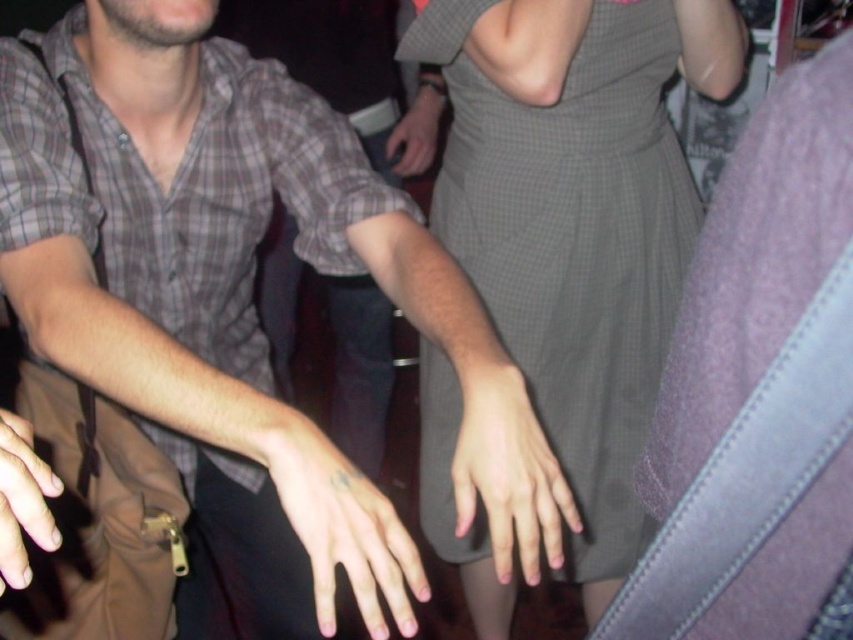
In the scene, there are two people. The first person is wearing a plaid short sleeve shirt and khaki pants, and the second person is in a gray knee length dress. There is also a hand at point (22, 500). Which person is the hand attached to?

The smooth skin hand at lower left located at point (22, 500) is attached to the first person wearing a plaid short sleeve shirt and khaki pants because the description specifies it is at lower left, which would be near the first person.

You are a photographer adjusting a camera with a 10cm wide lens. The camera is positioned to capture the pale skin tattooed hand at center. If the camera is at point 0.5,0.5, will the lens cover the hand at 0.820,0.401?

The pale skin tattooed hand at center is located at coordinates (341, 524). Since the camera lens is centered at (426, 320) and has a width of 10cm, the distance between the two points must be calculated. The Euclidean distance between these points is sqrt. However, without knowing the image dimensions, it is impossible to determine if the 10cm width covers the distance. Thus, the answer cannot be definitively determined with the given information.